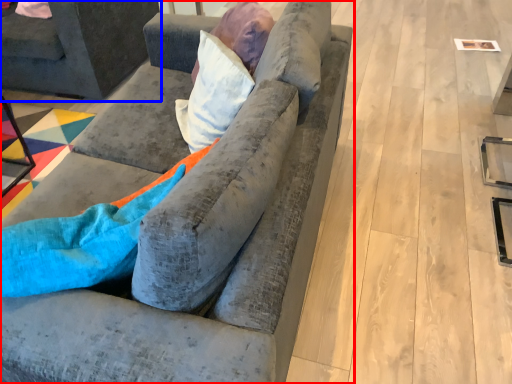
Question: Which point is closer to the camera, studio couch (highlighted by a red box) or studio couch (highlighted by a blue box)?

Choices:
 (A) studio couch
 (B) studio couch

Answer: (A)